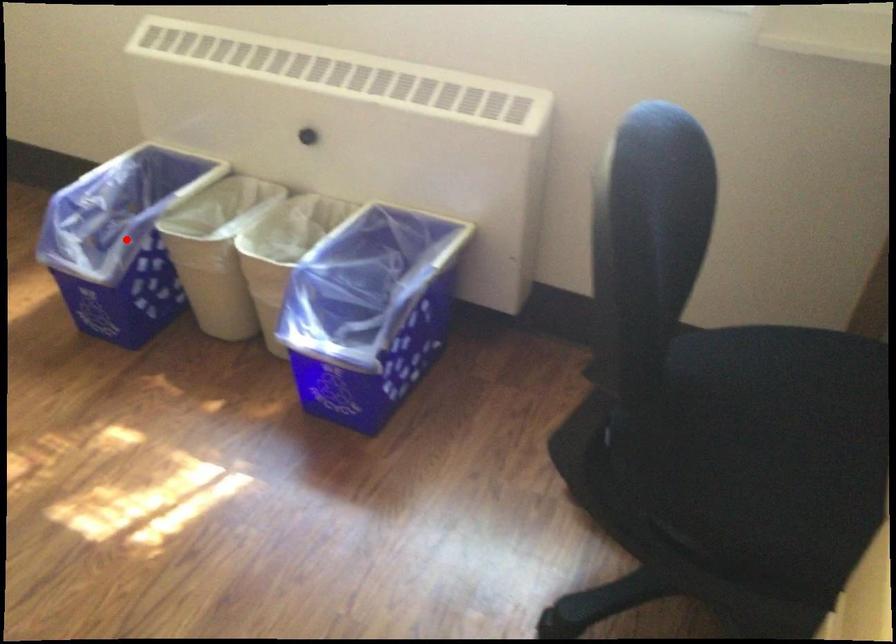
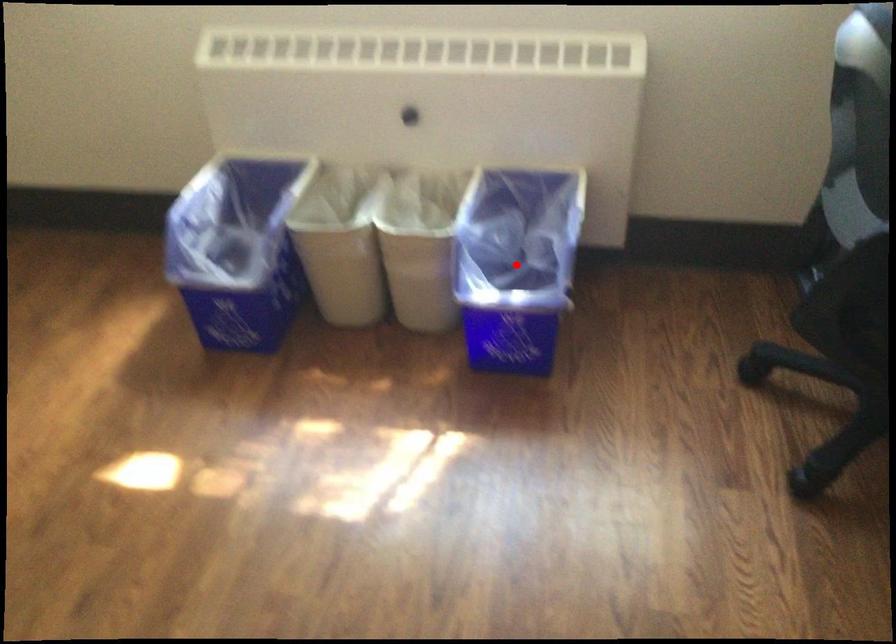
I am providing you with two images of the same scene from different viewpoints. A red point is marked on the first image and another point is marked on the second image. Do the highlighted points in image1 and image2 indicate the same real-world spot?

No